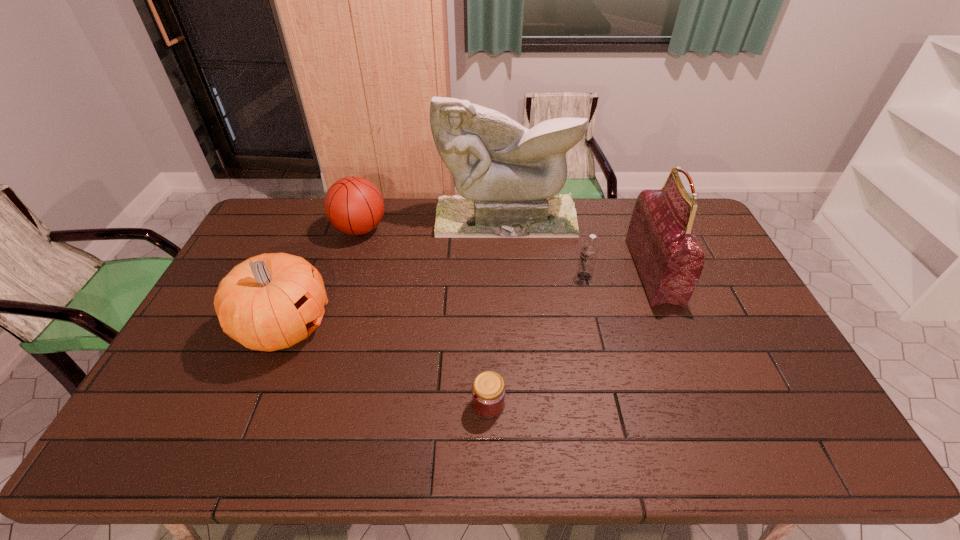
Locate an element on the screen. Image resolution: width=960 pixels, height=540 pixels. vacant space located on the front-facing side of the rightmost object is located at coordinates (618, 271).

The image size is (960, 540). Identify the location of vacant position located 0.260m on the front-facing side of the rightmost object. (558, 271).

Where is `free space located on the front-facing side of the fourth shortest object`? This screenshot has height=540, width=960. free space located on the front-facing side of the fourth shortest object is located at coordinates (371, 327).

Where is `vacant region located on the back of the basketball`? The height and width of the screenshot is (540, 960). vacant region located on the back of the basketball is located at coordinates (369, 202).

At what (x,y) coordinates should I click in order to perform the action: click on vacant space located on the front label of the second shortest object. Please return your answer as a coordinate pair (x, y). The height and width of the screenshot is (540, 960). Looking at the image, I should click on (460, 276).

I want to click on free spot located 0.310m on the front label of the second shortest object, so click(x=481, y=276).

What are the coordinates of `free space located on the front label of the second shortest object` in the screenshot? It's located at (517, 276).

At what (x,y) coordinates should I click in order to perform the action: click on vacant space located on the left of the nearest object. Please return your answer as a coordinate pair (x, y). Looking at the image, I should click on (332, 404).

Locate an element on the screen. Image resolution: width=960 pixels, height=540 pixels. sculpture situated at the far edge is located at coordinates (x=508, y=176).

Image resolution: width=960 pixels, height=540 pixels. I want to click on basketball that is at the far edge, so click(354, 205).